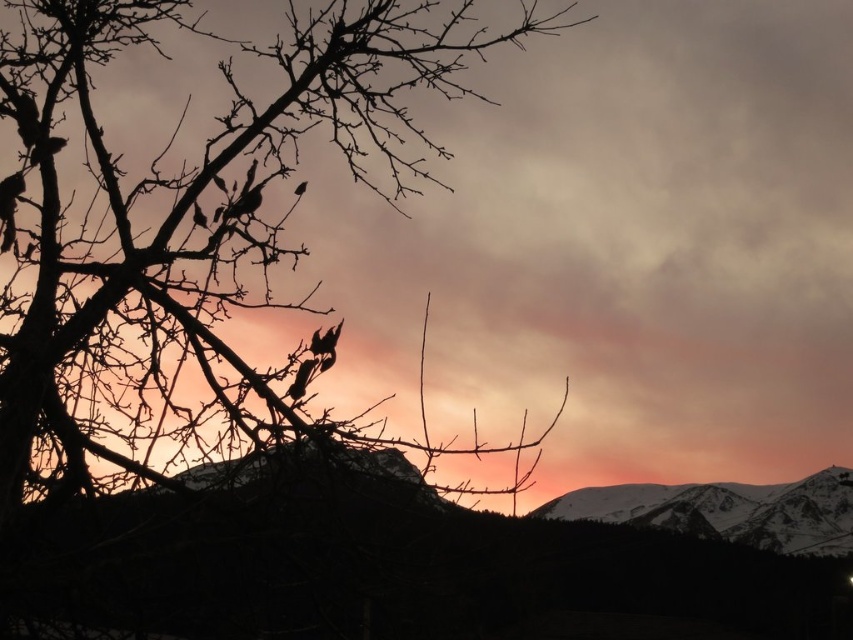
Does silhouette branches at left have a larger size compared to snowy rocky mountain at lower right?

Indeed, silhouette branches at left has a larger size compared to snowy rocky mountain at lower right.

The width and height of the screenshot is (853, 640). What do you see at coordinates (184, 224) in the screenshot? I see `silhouette branches at left` at bounding box center [184, 224].

Describe the element at coordinates (184, 224) in the screenshot. I see `silhouette branches at left` at that location.

At what (x,y) coordinates should I click in order to perform the action: click on silhouette branches at left. Please return your answer as a coordinate pair (x, y). This screenshot has height=640, width=853. Looking at the image, I should click on (184, 224).